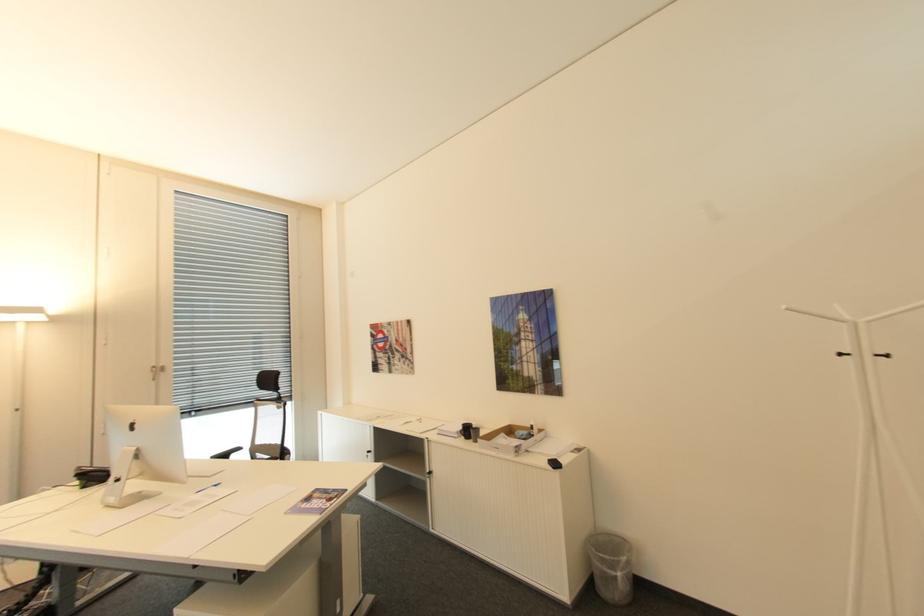
Locate an element on the screen. chair sitting surface is located at coordinates (264, 450).